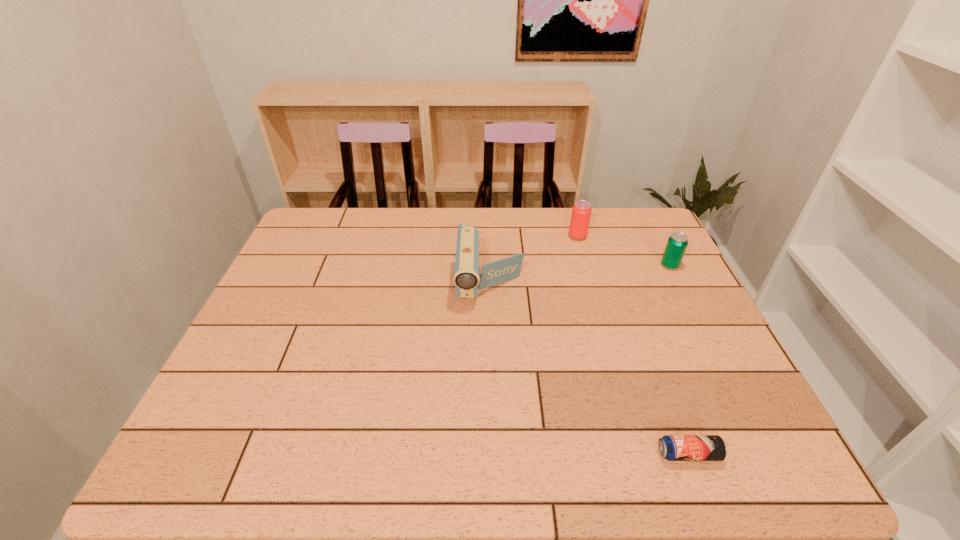
Identify the location of blank region between the third object from right to left and the shortest object. This screenshot has width=960, height=540. (633, 345).

You are a GUI agent. You are given a task and a screenshot of the screen. Output one action in this format:
    pyautogui.click(x=<x>, y=<y>)
    Task: Click on the free spot between the farthest object and the nearest object
    This screenshot has width=960, height=540.
    Given the screenshot: What is the action you would take?
    pyautogui.click(x=633, y=345)

This screenshot has width=960, height=540. Identify the location of vacant region between the farthest beer can and the shortest beer can. (633, 345).

The width and height of the screenshot is (960, 540). Find the location of `vacant point located between the leftmost object and the farthest beer can`. vacant point located between the leftmost object and the farthest beer can is located at coordinates (534, 259).

Locate an element on the screen. free space between the camcorder and the second farthest beer can is located at coordinates (580, 273).

Locate an element on the screen. The image size is (960, 540). vacant space in between the rightmost object and the second object from left to right is located at coordinates (624, 251).

Where is `vacant area that lies between the rightmost beer can and the camcorder`? Image resolution: width=960 pixels, height=540 pixels. vacant area that lies between the rightmost beer can and the camcorder is located at coordinates (580, 273).

Where is `free space between the third object from right to left and the rightmost object`? The width and height of the screenshot is (960, 540). free space between the third object from right to left and the rightmost object is located at coordinates (624, 251).

This screenshot has height=540, width=960. What are the coordinates of `free space between the rightmost beer can and the nearest object` in the screenshot? It's located at (679, 360).

Identify the location of the second closest object relative to the leftmost object. (677, 243).